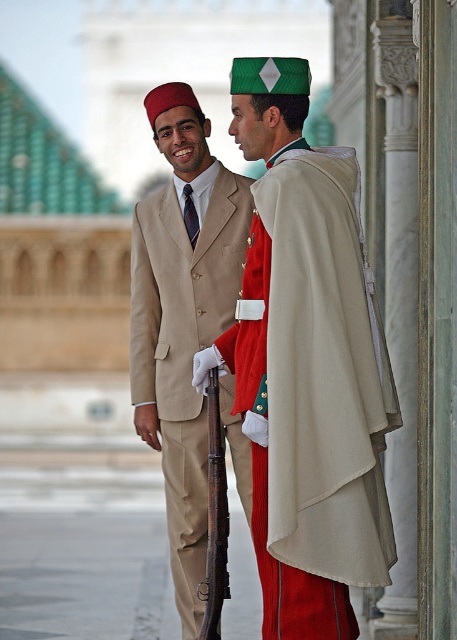
You are standing at point (x=189, y=161) and want to walk to point (x=323, y=637). Is the point you want to reach in front of you?

Yes, the point (x=323, y=637) is in front of point (x=189, y=161), so the destination is in front of you.